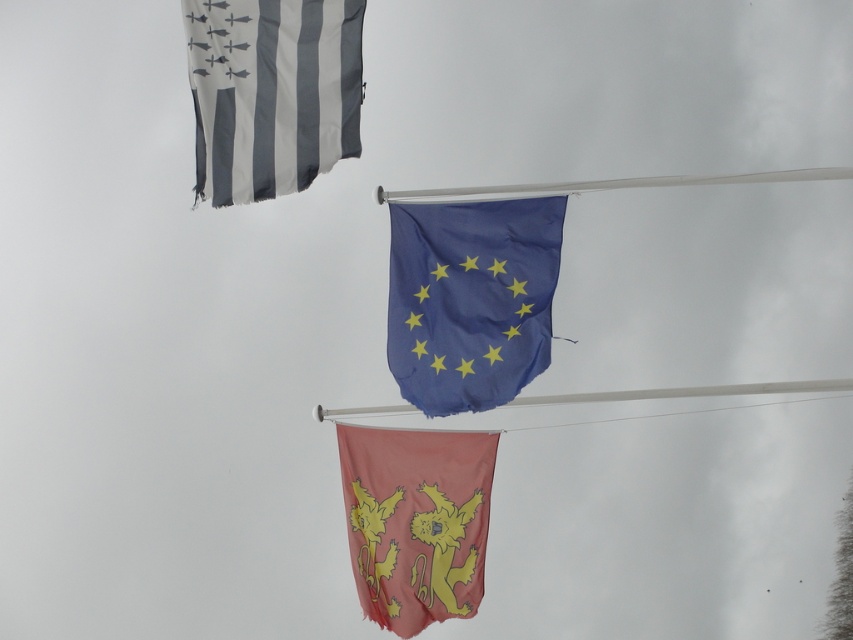
Between point (480, 241) and point (825, 177), which one is positioned in front?

Point (480, 241) is in front.

Is blue fabric flag at center positioned before white plastic flag pole at center?

Yes, blue fabric flag at center is closer to the viewer.

Between point (556, 246) and point (850, 170), which one is positioned in front?

Point (556, 246) is in front.

At what (x,y) coordinates should I click in order to perform the action: click on blue fabric flag at center. Please return your answer as a coordinate pair (x, y). The width and height of the screenshot is (853, 640). Looking at the image, I should click on (471, 300).

Is gray fabric flag at upper left further to the viewer compared to white plastic flag pole at center?

No, gray fabric flag at upper left is in front of white plastic flag pole at center.

Who is taller, gray fabric flag at upper left or white plastic flag pole at center?

With more height is gray fabric flag at upper left.

Who is more distant from viewer, (311, 170) or (753, 176)?

The point (753, 176) is more distant.

This screenshot has width=853, height=640. Find the location of `gray fabric flag at upper left`. gray fabric flag at upper left is located at coordinates (271, 92).

Which is more to the left, blue fabric flag at center or red fabric lion at center?

red fabric lion at center is more to the left.

Does blue fabric flag at center have a greater height compared to red fabric lion at center?

In fact, blue fabric flag at center may be shorter than red fabric lion at center.

Image resolution: width=853 pixels, height=640 pixels. What are the coordinates of `blue fabric flag at center` in the screenshot? It's located at coord(471,300).

In order to click on blue fabric flag at center in this screenshot , I will do `click(471, 300)`.